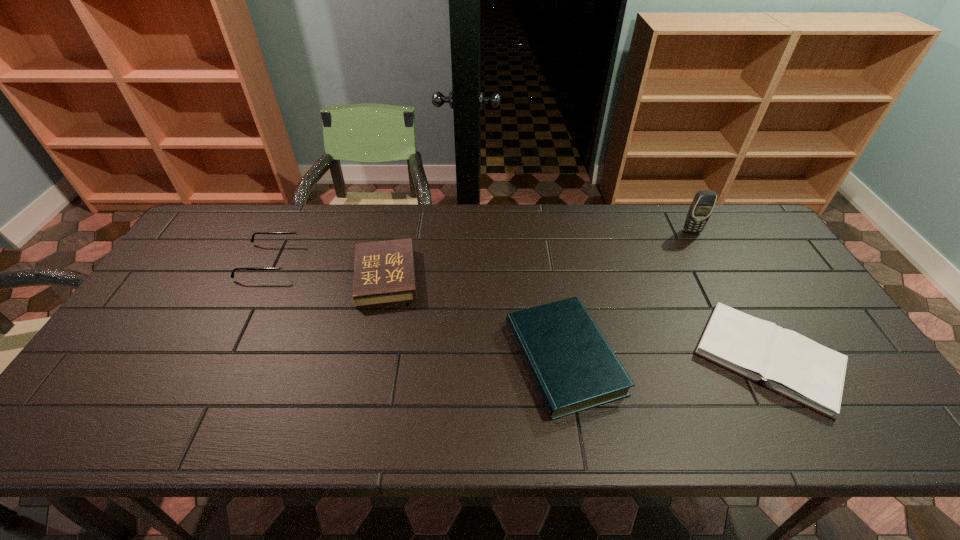
The width and height of the screenshot is (960, 540). I want to click on the farthest object, so click(703, 203).

Where is `cellular telephone`? This screenshot has width=960, height=540. cellular telephone is located at coordinates (703, 203).

Where is `spectacles`? The width and height of the screenshot is (960, 540). spectacles is located at coordinates (286, 266).

Locate an element on the screen. the fourth object from right to left is located at coordinates [384, 272].

The width and height of the screenshot is (960, 540). Find the location of `the second hardback book from right to left`. the second hardback book from right to left is located at coordinates (572, 366).

In order to click on the shortest hardback book in this screenshot , I will do 789,364.

You are a GUI agent. You are given a task and a screenshot of the screen. Output one action in this format:
    pyautogui.click(x=<x>, y=<y>)
    Task: Click on the rightmost hardback book
    
    Given the screenshot: What is the action you would take?
    pyautogui.click(x=789, y=364)

You are a GUI agent. You are given a task and a screenshot of the screen. Output one action in this format:
    pyautogui.click(x=<x>, y=<y>)
    Task: Click on the vacant area situated 0.070m on the front face of the tallest object
    
    Given the screenshot: What is the action you would take?
    (x=701, y=248)

Locate an element on the screen. vacant space located at the hinge ends of the spectacles is located at coordinates [x=409, y=262].

Where is `vacant space located 0.290m on the front of the second object from left to right`? This screenshot has width=960, height=540. vacant space located 0.290m on the front of the second object from left to right is located at coordinates (359, 404).